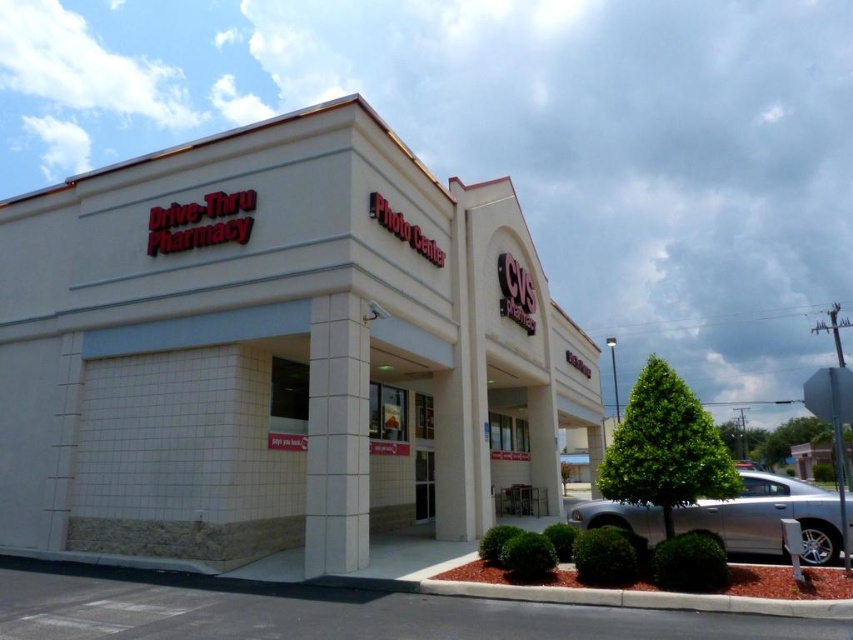
Which of these two, white tile building at center or silver metallic sedan at lower right, stands taller?

white tile building at center is taller.

Can you confirm if white tile building at center is bigger than silver metallic sedan at lower right?

Indeed, white tile building at center has a larger size compared to silver metallic sedan at lower right.

Is point (265, 504) in front of point (780, 540)?

No, (265, 504) is further to viewer.

In order to click on white tile building at center in this screenshot , I will do `click(277, 352)`.